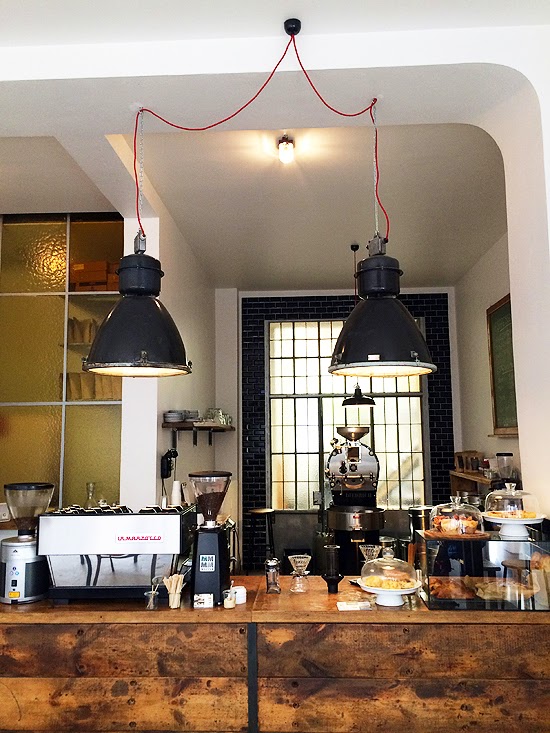
What are the coordinates of `shelf` in the screenshot? It's located at (197, 427).